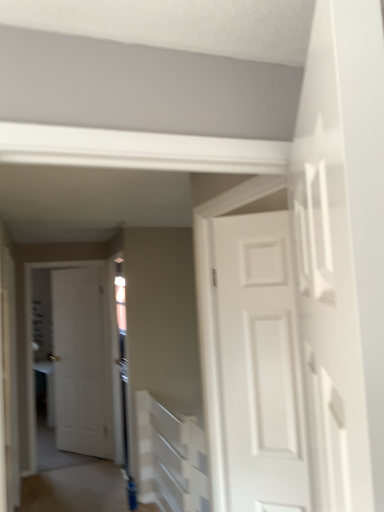
Question: Is white matte door at center, acting as the 1th door starting from the back, directly adjacent to blue glossy door at lower center?

Choices:
 (A) yes
 (B) no

Answer: (B)

Question: Is white matte door at center, which appears as the second door when viewed from the front, at the right side of blue glossy door at lower center?

Choices:
 (A) yes
 (B) no

Answer: (B)

Question: Could you tell me if white matte door at center, the first door positioned from the left, is turned towards blue glossy door at lower center?

Choices:
 (A) no
 (B) yes

Answer: (B)

Question: Can blue glossy door at lower center be found inside white matte door at center, acting as the 1th door starting from the back?

Choices:
 (A) yes
 (B) no

Answer: (B)

Question: Is blue glossy door at lower center at the back of white matte door at center, acting as the 1th door starting from the back?

Choices:
 (A) no
 (B) yes

Answer: (A)

Question: Considering the positions of point (94, 352) and point (46, 472), is point (94, 352) closer or farther from the camera than point (46, 472)?

Choices:
 (A) closer
 (B) farther

Answer: (B)

Question: Is white matte door at center, acting as the 1th door starting from the back, in front of or behind blue glossy door at lower center in the image?

Choices:
 (A) behind
 (B) front

Answer: (A)

Question: From their relative heights in the image, would you say white matte door at center, acting as the 1th door starting from the back, is taller or shorter than blue glossy door at lower center?

Choices:
 (A) short
 (B) tall

Answer: (B)

Question: Would you say white matte door at center, acting as the 1th door starting from the back, is inside or outside blue glossy door at lower center?

Choices:
 (A) inside
 (B) outside

Answer: (B)

Question: Is blue glossy door at lower center taller or shorter than white matte door at center, the second door when ordered from right to left?

Choices:
 (A) short
 (B) tall

Answer: (A)

Question: Is blue glossy door at lower center to the left or to the right of white matte door at center, the first door positioned from the left, in the image?

Choices:
 (A) right
 (B) left

Answer: (A)

Question: In terms of size, does blue glossy door at lower center appear bigger or smaller than white matte door at center, acting as the 1th door starting from the back?

Choices:
 (A) small
 (B) big

Answer: (B)

Question: From a real-world perspective, is blue glossy door at lower center physically located above or below white matte door at center, the first door positioned from the left?

Choices:
 (A) below
 (B) above

Answer: (A)

Question: Considering the positions of point (190, 477) and point (51, 325), is point (190, 477) closer or farther from the camera than point (51, 325)?

Choices:
 (A) farther
 (B) closer

Answer: (B)

Question: Visually, is white textured stairwell at center positioned to the left or to the right of white matte door at center, the first door positioned from the left?

Choices:
 (A) left
 (B) right

Answer: (B)